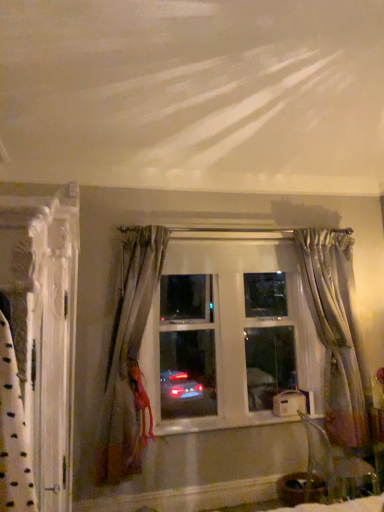
The width and height of the screenshot is (384, 512). What do you see at coordinates (253, 321) in the screenshot?
I see `clear glass window at center` at bounding box center [253, 321].

How much space does silvery sheer curtain at right, which appears as the 3th curtain when viewed from the left, occupy vertically?

It is 6.54 feet.

Where is `clear glass window at center`? The image size is (384, 512). clear glass window at center is located at coordinates (253, 321).

Considering the points (165, 425) and (342, 288), which point is behind, point (165, 425) or point (342, 288)?

The point (342, 288) is farther.

Is white painted wood at center oriented away from clear glass window at center?

No.

Is white painted wood at center positioned beyond the bounds of clear glass window at center?

Yes.

From a real-world perspective, is white painted wood at center beneath clear glass window at center?

Yes, from a real-world perspective, white painted wood at center is beneath clear glass window at center.

Is satin gray curtain at left, the 2th curtain positioned from the right, next to white painted wood at center?

No, satin gray curtain at left, the 2th curtain positioned from the right, is not beside white painted wood at center.

Considering the relative positions of satin gray curtain at left, the 2th curtain in the front-to-back sequence, and white painted wood at center in the image provided, is satin gray curtain at left, the 2th curtain in the front-to-back sequence, to the right of white painted wood at center from the viewer's perspective?

No, satin gray curtain at left, the 2th curtain in the front-to-back sequence, is not to the right of white painted wood at center.

Is satin gray curtain at left, the second curtain in the left-to-right sequence, shorter than white painted wood at center?

No, satin gray curtain at left, the second curtain in the left-to-right sequence, is not shorter than white painted wood at center.

From the picture: Between satin gray curtain at left, the 2th curtain positioned from the right, and clear glass window at center, which one has more height?

satin gray curtain at left, the 2th curtain positioned from the right.

Is satin gray curtain at left, the 2th curtain positioned from the right, not close to clear glass window at center?

No, there isn't a large distance between satin gray curtain at left, the 2th curtain positioned from the right, and clear glass window at center.

Which curtain is the 1st one when counting from the front of the clear glass window at center? Please provide its 2D coordinates.

[(128, 355)]

Which is nearer, (217, 345) or (64, 231)?

The point (64, 231) is in front.

Identify the location of the 2nd curtain counting from the left side of the clear glass window at center. (44, 327).

Is clear glass window at center not near white textured curtain at left, which appears as the 1th curtain when viewed from the left?

That's right, there is a large distance between clear glass window at center and white textured curtain at left, which appears as the 1th curtain when viewed from the left.

How different are the orientations of clear glass window at center and satin gray curtain at left, positioned as the 2th curtain in back-to-front order, in degrees?

The angle between the facing direction of clear glass window at center and the facing direction of satin gray curtain at left, positioned as the 2th curtain in back-to-front order, is 0.00188 degrees.

From a real-world perspective, which is physically below, clear glass window at center or satin gray curtain at left, the 2th curtain in the front-to-back sequence?

satin gray curtain at left, the 2th curtain in the front-to-back sequence.

Is clear glass window at center to the right of satin gray curtain at left, the second curtain in the left-to-right sequence, from the viewer's perspective?

Yes, clear glass window at center is to the right of satin gray curtain at left, the second curtain in the left-to-right sequence.

Can you confirm if clear glass window at center is bigger than satin gray curtain at left, the 2th curtain positioned from the right?

Indeed, clear glass window at center has a larger size compared to satin gray curtain at left, the 2th curtain positioned from the right.

Is silvery sheer curtain at right, placed as the third curtain when sorted from front to back, positioned with its back to clear glass window at center?

No, clear glass window at center is not at the back of silvery sheer curtain at right, placed as the third curtain when sorted from front to back.

Can you confirm if silvery sheer curtain at right, placed as the third curtain when sorted from front to back, is thinner than clear glass window at center?

In fact, silvery sheer curtain at right, placed as the third curtain when sorted from front to back, might be wider than clear glass window at center.

Based on their sizes in the image, would you say silvery sheer curtain at right, positioned as the 1th curtain in back-to-front order, is bigger or smaller than clear glass window at center?

In the image, silvery sheer curtain at right, positioned as the 1th curtain in back-to-front order, appears to be smaller than clear glass window at center.

From a real-world perspective, between silvery sheer curtain at right, placed as the third curtain when sorted from front to back, and clear glass window at center, who is vertically lower?

silvery sheer curtain at right, placed as the third curtain when sorted from front to back, from a real-world perspective.

What's the angular difference between white textured curtain at left, which is the first curtain in front-to-back order, and satin gray curtain at left, the second curtain in the left-to-right sequence,'s facing directions?

They differ by 90 degrees in their facing directions.

Considering the positions of objects white textured curtain at left, acting as the third curtain starting from the back, and satin gray curtain at left, the second curtain in the left-to-right sequence, in the image provided, who is in front, white textured curtain at left, acting as the third curtain starting from the back, or satin gray curtain at left, the second curtain in the left-to-right sequence,?

white textured curtain at left, acting as the third curtain starting from the back, is closer to the camera.

Is white textured curtain at left, which appears as the 3th curtain when viewed from the right, taller or shorter than satin gray curtain at left, the second curtain in the left-to-right sequence?

In the image, white textured curtain at left, which appears as the 3th curtain when viewed from the right, appears to be taller than satin gray curtain at left, the second curtain in the left-to-right sequence.

From a real-world perspective, is white textured curtain at left, which appears as the 1th curtain when viewed from the left, beneath satin gray curtain at left, the 2th curtain positioned from the right?

Yes, from a real-world perspective, white textured curtain at left, which appears as the 1th curtain when viewed from the left, is below satin gray curtain at left, the 2th curtain positioned from the right.

This screenshot has height=512, width=384. Identify the location of window sill in front of the clear glass window at center. (220, 423).

Locate an element on the screen. Image resolution: width=384 pixels, height=512 pixels. window sill below the satin gray curtain at left, the 2th curtain in the front-to-back sequence (from the image's perspective) is located at coordinates (220, 423).

Estimate the real-world distances between objects in this image. Which object is further from white painted wood at center, white textured curtain at left, acting as the third curtain starting from the back, or clear glass window at center?

white textured curtain at left, acting as the third curtain starting from the back, is positioned further to the anchor white painted wood at center.

Which object lies nearer to the anchor point white textured curtain at left, which is the first curtain in front-to-back order, white painted wood at center or clear glass window at center?

Based on the image, clear glass window at center appears to be nearer to white textured curtain at left, which is the first curtain in front-to-back order.

Based on their spatial positions, is white painted wood at center or satin gray curtain at left, positioned as the 2th curtain in back-to-front order, closer to clear glass window at center?

satin gray curtain at left, positioned as the 2th curtain in back-to-front order, is positioned closer to the anchor clear glass window at center.

Looking at this image, based on their spatial positions, is clear glass window at center or white textured curtain at left, acting as the third curtain starting from the back, further from white painted wood at center?

Based on the image, white textured curtain at left, acting as the third curtain starting from the back, appears to be further to white painted wood at center.

From the image, which object appears to be farther from satin gray curtain at left, positioned as the 2th curtain in back-to-front order, white textured curtain at left, which appears as the 3th curtain when viewed from the right, or silvery sheer curtain at right, placed as the third curtain when sorted from front to back?

Among the two, white textured curtain at left, which appears as the 3th curtain when viewed from the right, is located further to satin gray curtain at left, positioned as the 2th curtain in back-to-front order.

Considering their positions, is clear glass window at center positioned further to silvery sheer curtain at right, placed as the third curtain when sorted from front to back, than white textured curtain at left, acting as the third curtain starting from the back?

white textured curtain at left, acting as the third curtain starting from the back.

Which object lies nearer to the anchor point white textured curtain at left, which appears as the 1th curtain when viewed from the left, clear glass window at center or white painted wood at center?

clear glass window at center is positioned closer to the anchor white textured curtain at left, which appears as the 1th curtain when viewed from the left.

Estimate the real-world distances between objects in this image. Which object is closer to silvery sheer curtain at right, placed as the third curtain when sorted from front to back, white textured curtain at left, acting as the third curtain starting from the back, or white painted wood at center?

white painted wood at center lies closer to silvery sheer curtain at right, placed as the third curtain when sorted from front to back, than the other object.

This screenshot has width=384, height=512. I want to click on window positioned between white textured curtain at left, which appears as the 1th curtain when viewed from the left, and silvery sheer curtain at right, positioned as the 1th curtain in back-to-front order, from near to far, so click(x=253, y=321).

This screenshot has width=384, height=512. Find the location of `window sill situated between clear glass window at center and silvery sheer curtain at right, placed as the third curtain when sorted from front to back, from left to right`. window sill situated between clear glass window at center and silvery sheer curtain at right, placed as the third curtain when sorted from front to back, from left to right is located at coordinates (220, 423).

You are a GUI agent. You are given a task and a screenshot of the screen. Output one action in this format:
    pyautogui.click(x=<x>, y=<y>)
    Task: Click on the window between satin gray curtain at left, the 2th curtain positioned from the right, and silvery sheer curtain at right, which appears as the 3th curtain when viewed from the left, from left to right
    Image resolution: width=384 pixels, height=512 pixels.
    Given the screenshot: What is the action you would take?
    pyautogui.click(x=253, y=321)

Locate an element on the screen. This screenshot has height=512, width=384. window sill between white textured curtain at left, which appears as the 3th curtain when viewed from the right, and silvery sheer curtain at right, positioned as the 1th curtain in back-to-front order, along the z-axis is located at coordinates (220, 423).